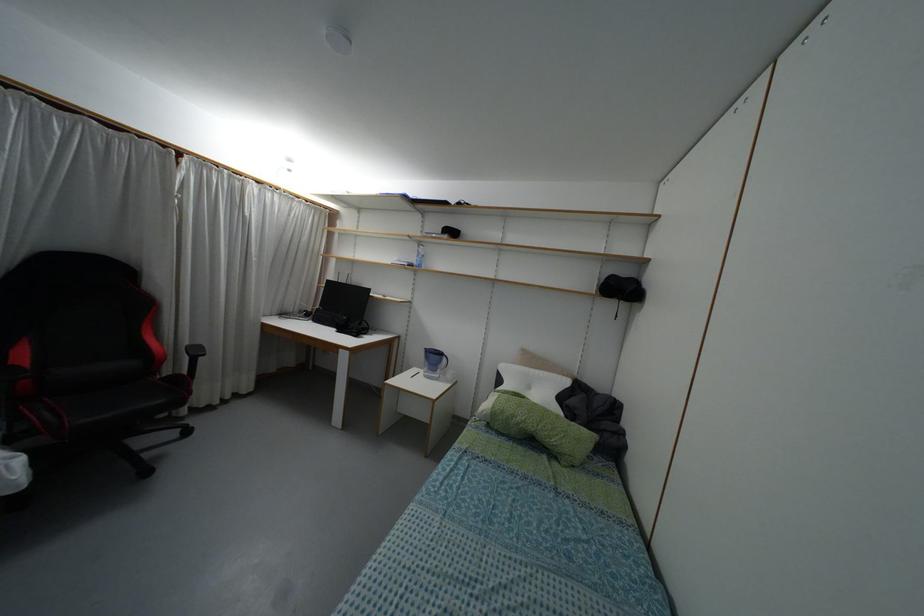
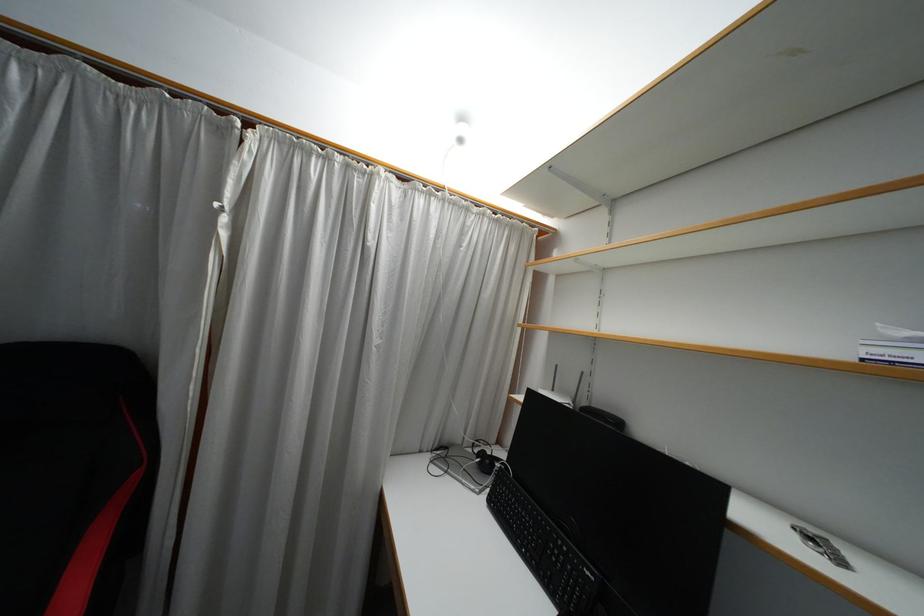
Find the pixel in the second image that matches [289,169] in the first image.

(459, 140)